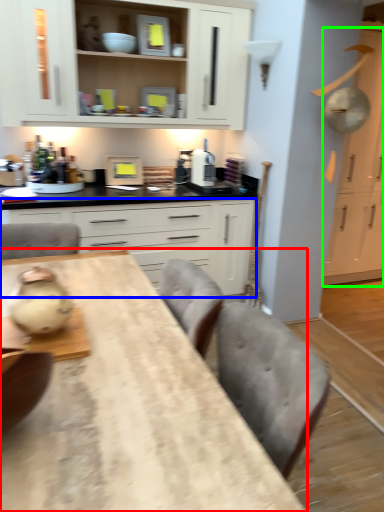
Question: Which is farther away from table (highlighted by a red box)? cabinetry (highlighted by a blue box) or cabinetry (highlighted by a green box)?

Choices:
 (A) cabinetry
 (B) cabinetry

Answer: (B)